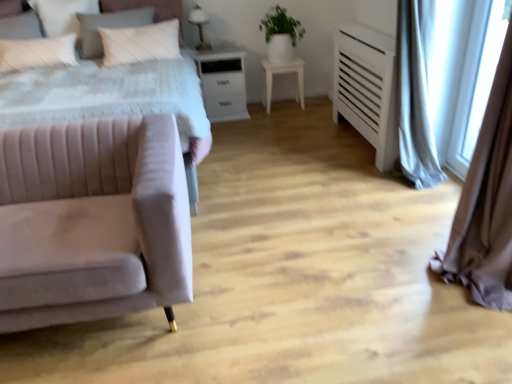
Where is `spots to the right of white matte table at center`? Image resolution: width=512 pixels, height=384 pixels. spots to the right of white matte table at center is located at coordinates (320, 105).